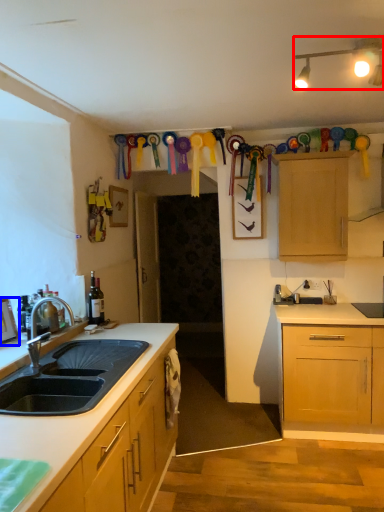
Question: Which object appears farthest to the camera in this image, lamp (highlighted by a red box) or picture frame (highlighted by a blue box)?

Choices:
 (A) lamp
 (B) picture frame

Answer: (B)